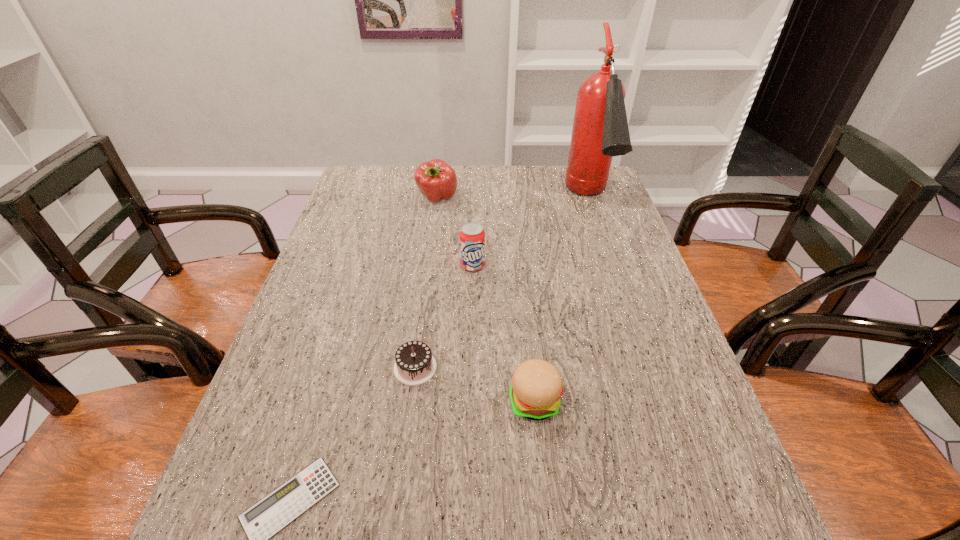
The height and width of the screenshot is (540, 960). In order to click on free region located 0.170m on the surface of the soda can in this screenshot , I will do `click(471, 320)`.

Find the location of a particular element. The width and height of the screenshot is (960, 540). vacant area situated 0.060m on the left of the second object from right to left is located at coordinates (479, 401).

You are a GUI agent. You are given a task and a screenshot of the screen. Output one action in this format:
    pyautogui.click(x=<x>, y=<y>)
    Task: Click on the vacant space located 0.140m on the back of the fifth tallest object
    Image resolution: width=960 pixels, height=540 pixels.
    Given the screenshot: What is the action you would take?
    pyautogui.click(x=423, y=306)

The height and width of the screenshot is (540, 960). What are the coordinates of `fire extinguisher that is at the far edge` in the screenshot? It's located at pyautogui.click(x=600, y=131).

Identify the location of pepper that is at the far edge. (435, 179).

Image resolution: width=960 pixels, height=540 pixels. Find the location of `object that is at the right edge`. object that is at the right edge is located at coordinates (600, 131).

This screenshot has height=540, width=960. Find the location of `object that is at the far right corner`. object that is at the far right corner is located at coordinates (600, 131).

Where is `free spot at the far edge of the desktop`? This screenshot has height=540, width=960. free spot at the far edge of the desktop is located at coordinates (533, 191).

In the image, there is a desktop. At what (x,y) coordinates should I click in order to perform the action: click on vacant space at the near edge. Please return your answer as a coordinate pair (x, y). The image size is (960, 540). Looking at the image, I should click on (654, 527).

Identify the location of blank area at the left edge. This screenshot has width=960, height=540. (282, 368).